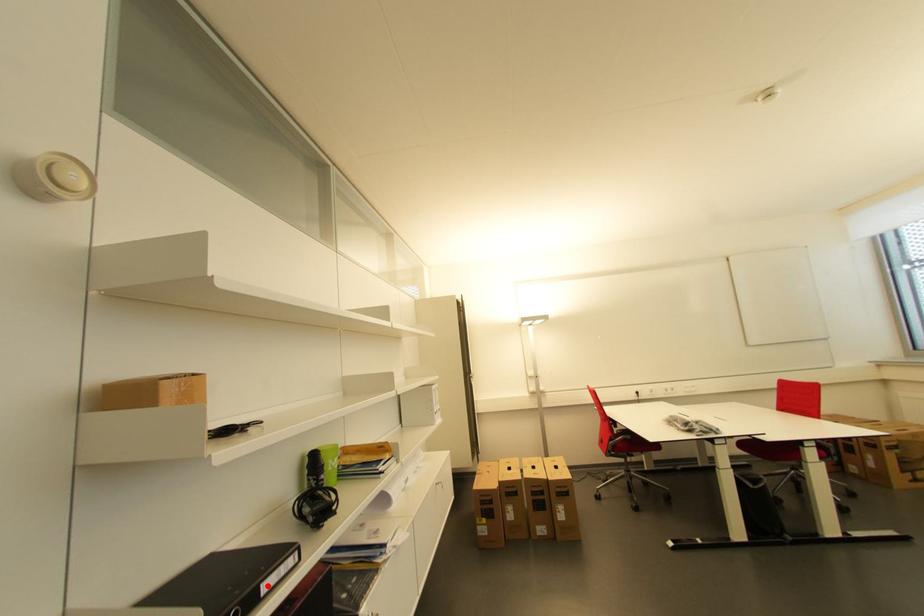
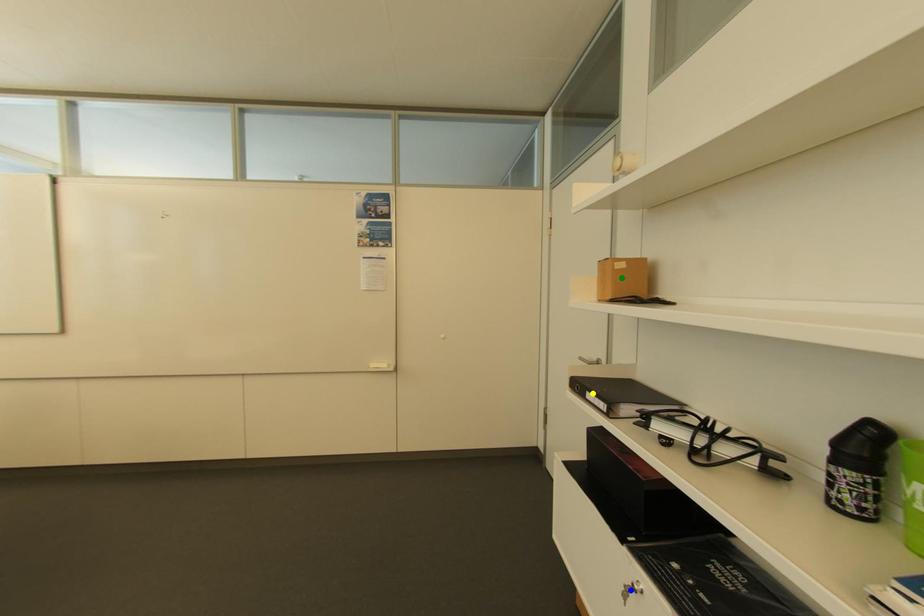
Question: I am providing you with two images of the same scene from different viewpoints. A red point is marked on the first image. You are given multiple points on the second image. Which point in image 2 is actually the same real-world point as the red point in image 1?

Choices:
 (A) blue point
 (B) green point
 (C) yellow point

Answer: (C)